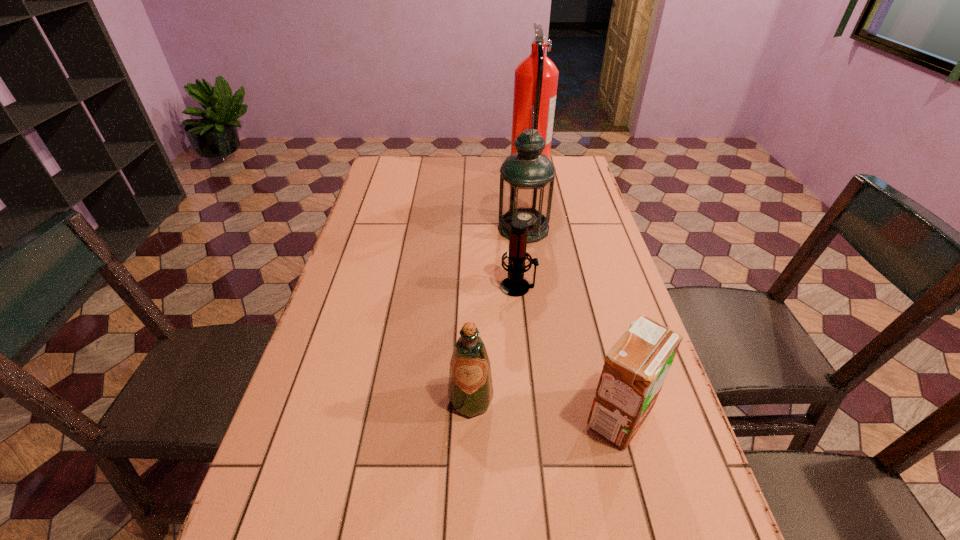
The width and height of the screenshot is (960, 540). What are the coordinates of `vacant point located 0.280m on the back of the fourth shortest object` in the screenshot? It's located at (516, 174).

The width and height of the screenshot is (960, 540). I want to click on free space located 0.300m on the straw side of the carton, so point(437,416).

This screenshot has width=960, height=540. I want to click on free space located 0.320m on the straw side of the carton, so click(x=427, y=416).

This screenshot has width=960, height=540. I want to click on free space located 0.170m on the straw side of the carton, so click(500, 416).

Find the location of `vacant area situated 0.140m on the front-facing side of the leftmost object`. vacant area situated 0.140m on the front-facing side of the leftmost object is located at coordinates (469, 490).

Identify the location of vacant space located on the left of the microphone. The height and width of the screenshot is (540, 960). (474, 287).

At what (x,y) coordinates should I click in order to perform the action: click on object that is at the far edge. Please return your answer as a coordinate pair (x, y). The width and height of the screenshot is (960, 540). Looking at the image, I should click on (536, 78).

This screenshot has width=960, height=540. Identify the location of fire extinguisher at the right edge. (536, 78).

Where is `carton present at the right edge`? The height and width of the screenshot is (540, 960). carton present at the right edge is located at coordinates (635, 369).

The image size is (960, 540). Find the location of `object that is positioned at the far right corner`. object that is positioned at the far right corner is located at coordinates (536, 78).